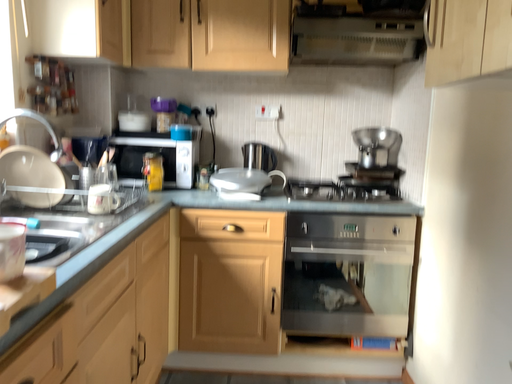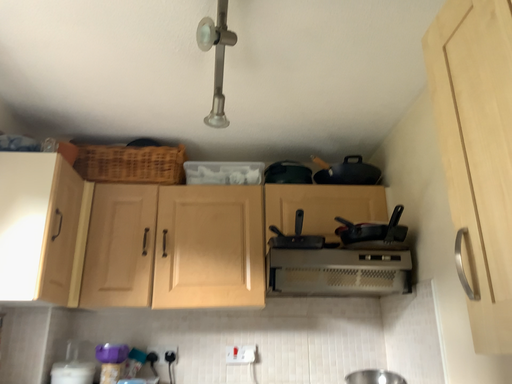
Question: How did the camera likely rotate when shooting the video?

Choices:
 (A) rotated upward
 (B) rotated downward

Answer: (A)